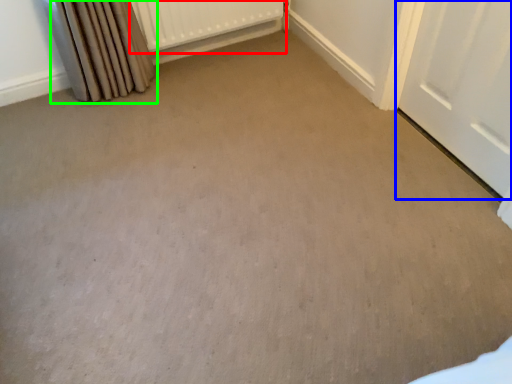
Question: Estimate the real-world distances between objects in this image. Which object is farther from radiator (highlighted by a red box), door (highlighted by a blue box) or curtain (highlighted by a green box)?

Choices:
 (A) door
 (B) curtain

Answer: (A)